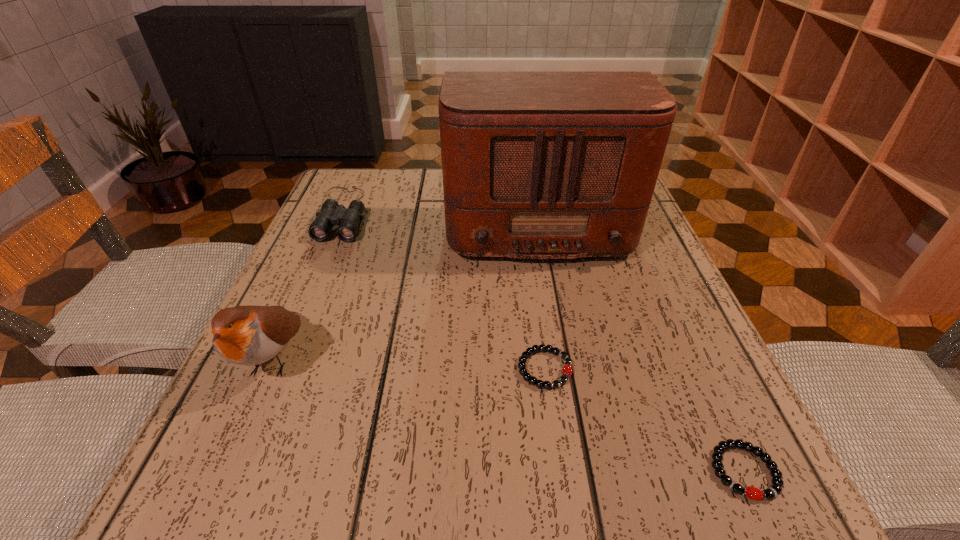
Locate an element on the screen. The image size is (960, 540). free space located 0.340m on the left of the nearest object is located at coordinates (448, 471).

Where is `radio receiver present at the far edge`? The height and width of the screenshot is (540, 960). radio receiver present at the far edge is located at coordinates (536, 164).

Find the location of a particular element. This screenshot has width=960, height=540. binoculars present at the far edge is located at coordinates (331, 213).

Image resolution: width=960 pixels, height=540 pixels. In order to click on object situated at the near edge in this screenshot , I will do tap(774, 490).

Find the location of a particular element. The image size is (960, 540). bird that is positioned at the left edge is located at coordinates (248, 335).

The width and height of the screenshot is (960, 540). I want to click on binoculars present at the left edge, so click(331, 213).

At what (x,y) coordinates should I click in order to perform the action: click on radio receiver that is at the right edge. Please return your answer as a coordinate pair (x, y). Looking at the image, I should click on (536, 164).

Image resolution: width=960 pixels, height=540 pixels. Find the location of `bracelet that is positioned at the right edge`. bracelet that is positioned at the right edge is located at coordinates [x=774, y=490].

Find the location of `object that is positioned at the far left corner`. object that is positioned at the far left corner is located at coordinates (331, 213).

You are a GUI agent. You are given a task and a screenshot of the screen. Output one action in this format:
    pyautogui.click(x=<x>, y=<y>)
    Task: Click on the object present at the far right corner
    
    Given the screenshot: What is the action you would take?
    pyautogui.click(x=536, y=164)